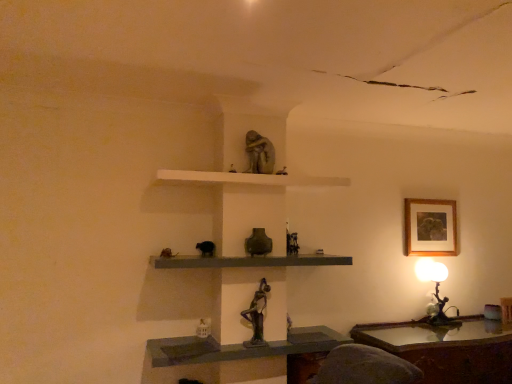
Question: From a real-world perspective, does wooden polished table at lower right sit lower than matte gray stone statue at upper center, positioned as the 1th sculpture in top-to-bottom order?

Choices:
 (A) yes
 (B) no

Answer: (A)

Question: Is matte gray stone statue at upper center, placed as the 2th sculpture when sorted from bottom to top, at the back of wooden polished table at lower right?

Choices:
 (A) yes
 (B) no

Answer: (B)

Question: Can you see wooden polished table at lower right touching matte gray stone statue at upper center, positioned as the 1th sculpture in top-to-bottom order?

Choices:
 (A) yes
 (B) no

Answer: (B)

Question: From a real-world perspective, is wooden polished table at lower right over matte gray stone statue at upper center, positioned as the 1th sculpture in top-to-bottom order?

Choices:
 (A) yes
 (B) no

Answer: (B)

Question: From the image's perspective, is wooden polished table at lower right over matte gray stone statue at upper center, placed as the 2th sculpture when sorted from bottom to top?

Choices:
 (A) yes
 (B) no

Answer: (B)

Question: Considering the relative positions of wooden polished table at lower right and matte gray stone statue at upper center, placed as the 2th sculpture when sorted from bottom to top, in the image provided, is wooden polished table at lower right to the right of matte gray stone statue at upper center, placed as the 2th sculpture when sorted from bottom to top, from the viewer's perspective?

Choices:
 (A) no
 (B) yes

Answer: (B)

Question: From a real-world perspective, is bronze statue at center, the 2th sculpture in the top-to-bottom sequence, on top of matte gray stone statue at upper center, positioned as the 1th sculpture in top-to-bottom order?

Choices:
 (A) yes
 (B) no

Answer: (B)

Question: Does bronze statue at center, the 2th sculpture in the top-to-bottom sequence, have a greater width compared to matte gray stone statue at upper center, placed as the 2th sculpture when sorted from bottom to top?

Choices:
 (A) yes
 (B) no

Answer: (B)

Question: Does bronze statue at center, the first sculpture from the bottom, have a lesser height compared to matte gray stone statue at upper center, placed as the 2th sculpture when sorted from bottom to top?

Choices:
 (A) yes
 (B) no

Answer: (B)

Question: From the image's perspective, is bronze statue at center, the first sculpture from the bottom, on top of matte gray stone statue at upper center, positioned as the 1th sculpture in top-to-bottom order?

Choices:
 (A) no
 (B) yes

Answer: (A)

Question: From a real-world perspective, is bronze statue at center, the 2th sculpture in the top-to-bottom sequence, beneath matte gray stone statue at upper center, positioned as the 1th sculpture in top-to-bottom order?

Choices:
 (A) yes
 (B) no

Answer: (A)

Question: Is bronze statue at center, the first sculpture from the bottom, behind matte gray stone statue at upper center, placed as the 2th sculpture when sorted from bottom to top?

Choices:
 (A) yes
 (B) no

Answer: (B)

Question: From the image's perspective, is metallic bronze figurine at right above matte gray shelf at center, acting as the second shelf starting from the top?

Choices:
 (A) no
 (B) yes

Answer: (A)